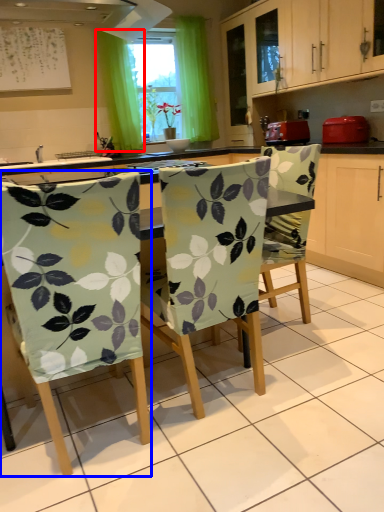
Question: Among these objects, which one is nearest to the camera, curtain (highlighted by a red box) or chair (highlighted by a blue box)?

Choices:
 (A) curtain
 (B) chair

Answer: (B)